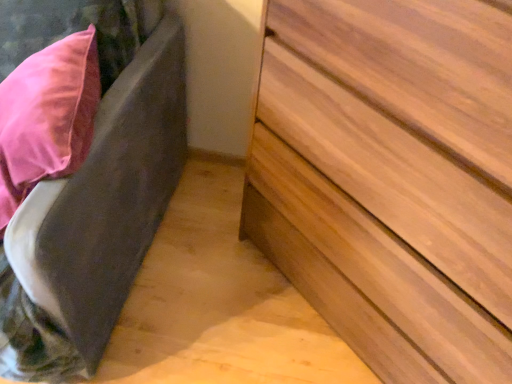
Question: Is point (104, 336) positioned closer to the camera than point (330, 21)?

Choices:
 (A) closer
 (B) farther

Answer: (B)

Question: Considering their positions, is velvet gray bed frame at left located in front of or behind light brown wood chest of drawers at lower right?

Choices:
 (A) front
 (B) behind

Answer: (B)

Question: Is velvet gray bed frame at left inside the boundaries of light brown wood chest of drawers at lower right, or outside?

Choices:
 (A) outside
 (B) inside

Answer: (A)

Question: Is light brown wood chest of drawers at lower right situated inside velvet gray bed frame at left or outside?

Choices:
 (A) outside
 (B) inside

Answer: (A)

Question: Considering the positions of light brown wood chest of drawers at lower right and velvet gray bed frame at left in the image, is light brown wood chest of drawers at lower right wider or thinner than velvet gray bed frame at left?

Choices:
 (A) wide
 (B) thin

Answer: (B)

Question: Looking at the image, does light brown wood chest of drawers at lower right seem bigger or smaller compared to velvet gray bed frame at left?

Choices:
 (A) small
 (B) big

Answer: (A)

Question: From the image's perspective, is light brown wood chest of drawers at lower right above or below velvet gray bed frame at left?

Choices:
 (A) above
 (B) below

Answer: (B)